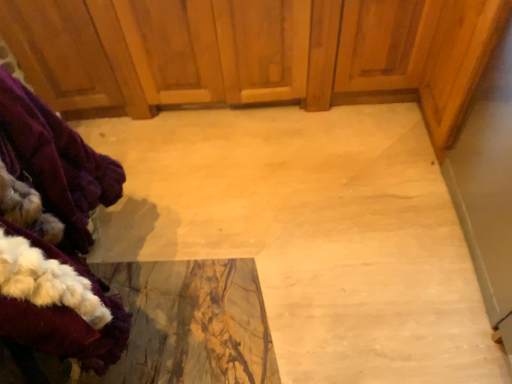
Question: Which is correct: velvety purple coat at left is inside wooden dresser at center, or outside of it?

Choices:
 (A) inside
 (B) outside

Answer: (B)

Question: Considering the positions of point (26, 145) and point (163, 1), is point (26, 145) closer or farther from the camera than point (163, 1)?

Choices:
 (A) closer
 (B) farther

Answer: (A)

Question: Considering the positions of velvety purple coat at left and wooden dresser at center in the image, is velvety purple coat at left wider or thinner than wooden dresser at center?

Choices:
 (A) thin
 (B) wide

Answer: (A)

Question: Based on their sizes in the image, would you say wooden dresser at center is bigger or smaller than velvety purple coat at left?

Choices:
 (A) small
 (B) big

Answer: (B)

Question: Is wooden dresser at center situated inside velvety purple coat at left or outside?

Choices:
 (A) inside
 (B) outside

Answer: (B)

Question: Considering the positions of point (190, 59) and point (82, 213), is point (190, 59) closer or farther from the camera than point (82, 213)?

Choices:
 (A) closer
 (B) farther

Answer: (B)

Question: In terms of height, does wooden dresser at center look taller or shorter compared to velvety purple coat at left?

Choices:
 (A) short
 (B) tall

Answer: (A)